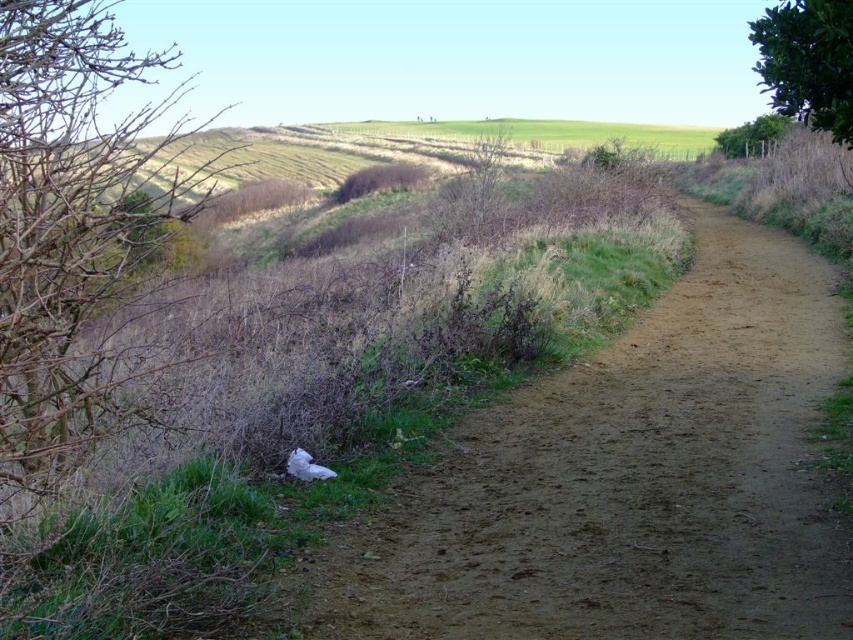
In the scene shown: You are a hiker who wants to take a shortcut to the green leafy hedge at upper right. You see the brown dirt track at center. Is the track located below the hedge?

The brown dirt track at center is positioned under green leafy hedge at upper right, so yes, the track is located below the hedge.